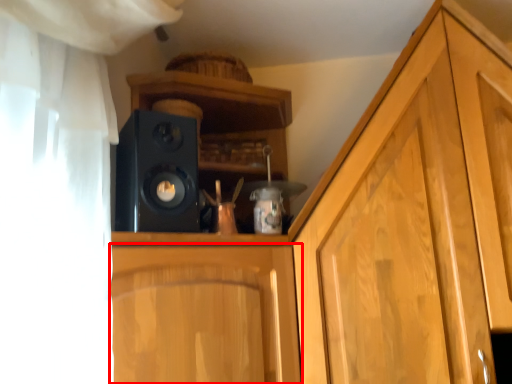
Question: From the image's perspective, what is the correct spatial relationship of cabinetry (annotated by the red box) in relation to speaker?

Choices:
 (A) above
 (B) below

Answer: (B)